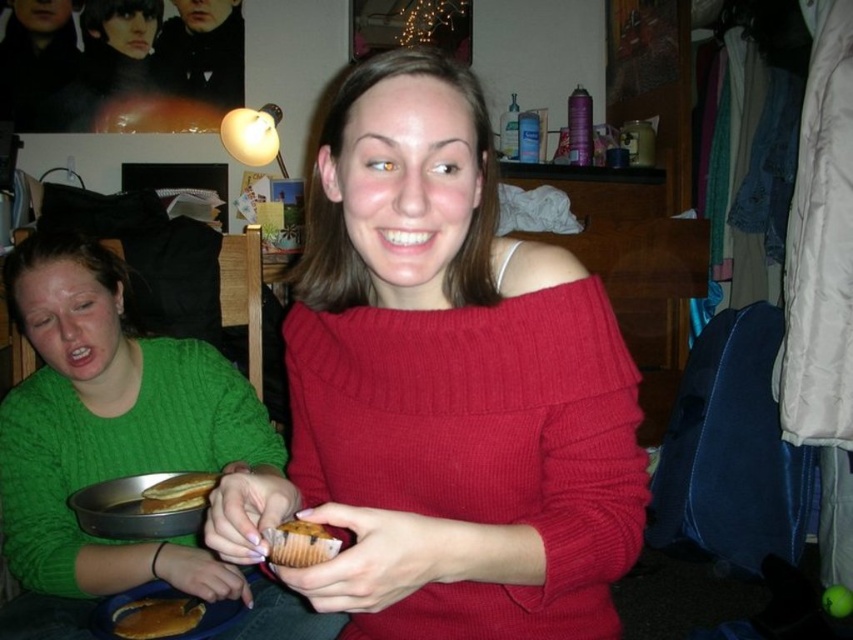
Can you confirm if brown crumbly muffin at center is smaller than golden crispy pancakes at left?

Correct, brown crumbly muffin at center occupies less space than golden crispy pancakes at left.

Which is behind, point (294, 545) or point (189, 504)?

The point (189, 504) is more distant.

Is point (305, 538) positioned behind point (209, 474)?

No, (305, 538) is in front of (209, 474).

The image size is (853, 640). Find the location of `brown crumbly muffin at center`. brown crumbly muffin at center is located at coordinates (300, 544).

Is matte red sweater at center below golden crispy pancakes at left?

No.

Does matte red sweater at center have a larger size compared to golden crispy pancakes at left?

Correct, matte red sweater at center is larger in size than golden crispy pancakes at left.

Find the location of `matte red sweater at center`. matte red sweater at center is located at coordinates (444, 388).

Which is more to the right, golden brown pancake at lower left or golden crispy pancakes at left?

Positioned to the right is golden crispy pancakes at left.

Which is below, golden brown pancake at lower left or golden crispy pancakes at left?

golden brown pancake at lower left

This screenshot has width=853, height=640. I want to click on golden brown pancake at lower left, so click(x=157, y=618).